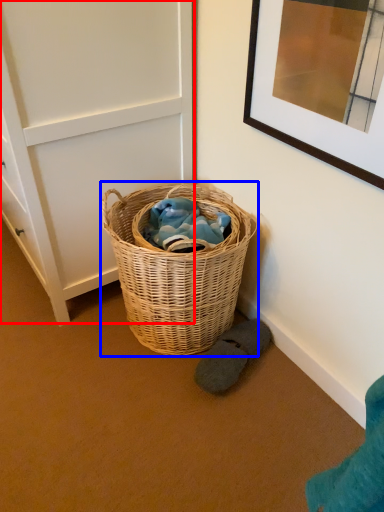
Question: Among these objects, which one is farthest to the camera, door (highlighted by a red box) or picnic basket (highlighted by a blue box)?

Choices:
 (A) door
 (B) picnic basket

Answer: (B)